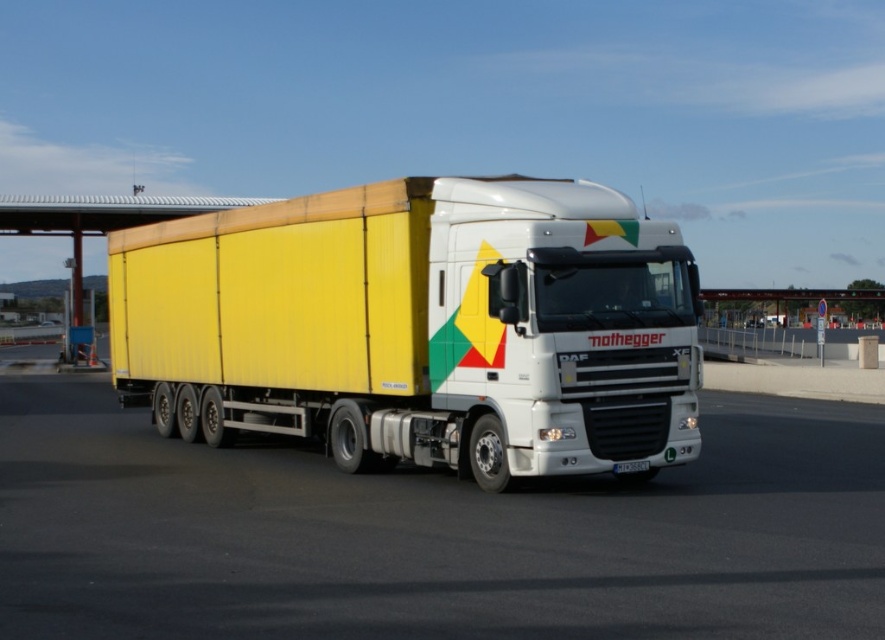
Question: Where is white glossy highway at center located in relation to yellow matte trailer at center in the image?

Choices:
 (A) right
 (B) left

Answer: (A)

Question: Which object appears closest to the camera in this image?

Choices:
 (A) yellow matte trailer at center
 (B) white glossy highway at center

Answer: (B)

Question: Can you confirm if white glossy highway at center is positioned to the right of yellow matte trailer at center?

Choices:
 (A) no
 (B) yes

Answer: (B)

Question: Is white glossy highway at center below yellow matte trailer at center?

Choices:
 (A) no
 (B) yes

Answer: (B)

Question: Which object appears closest to the camera in this image?

Choices:
 (A) white glossy highway at center
 (B) yellow matte trailer at center

Answer: (A)